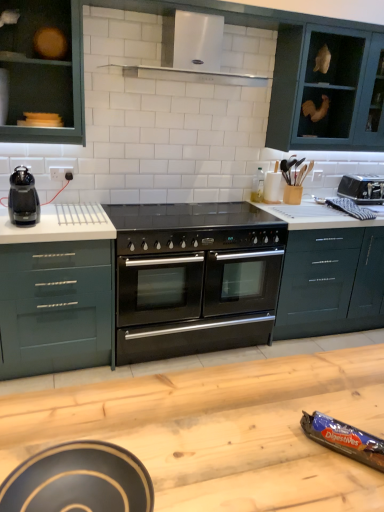
Question: Does white stainless steel exhaust hood at upper center lie in front of black matte oven at center?

Choices:
 (A) yes
 (B) no

Answer: (A)

Question: Does white stainless steel exhaust hood at upper center turn towards black matte oven at center?

Choices:
 (A) no
 (B) yes

Answer: (A)

Question: Is white stainless steel exhaust hood at upper center touching black matte oven at center?

Choices:
 (A) yes
 (B) no

Answer: (B)

Question: Is black matte oven at center at the back of white stainless steel exhaust hood at upper center?

Choices:
 (A) no
 (B) yes

Answer: (A)

Question: Can we say white stainless steel exhaust hood at upper center lies outside black matte oven at center?

Choices:
 (A) yes
 (B) no

Answer: (A)

Question: Does white stainless steel exhaust hood at upper center have a greater width compared to black matte oven at center?

Choices:
 (A) no
 (B) yes

Answer: (A)

Question: From a real-world perspective, does glossy dark green drawer at center-right, the first drawer in the right-to-left sequence, stand above matte black bowl at lower left, arranged as the 1th appliance when viewed from the front?

Choices:
 (A) no
 (B) yes

Answer: (A)

Question: Is the depth of glossy dark green drawer at center-right, the first drawer in the right-to-left sequence, greater than that of matte black bowl at lower left, positioned as the 3th appliance in top-to-bottom order?

Choices:
 (A) yes
 (B) no

Answer: (A)

Question: Can you confirm if glossy dark green drawer at center-right, the second drawer in the left-to-right sequence, is positioned to the right of matte black bowl at lower left, arranged as the 3th appliance when viewed from the right?

Choices:
 (A) no
 (B) yes

Answer: (B)

Question: Is glossy dark green drawer at center-right, the first drawer in the right-to-left sequence, facing towards matte black bowl at lower left, positioned as the 3th appliance in top-to-bottom order?

Choices:
 (A) no
 (B) yes

Answer: (A)

Question: Considering the relative sizes of glossy dark green drawer at center-right, the first drawer in the right-to-left sequence, and matte black bowl at lower left, arranged as the 3th appliance when viewed from the right, in the image provided, is glossy dark green drawer at center-right, the first drawer in the right-to-left sequence, bigger than matte black bowl at lower left, arranged as the 3th appliance when viewed from the right,?

Choices:
 (A) no
 (B) yes

Answer: (B)

Question: From the image's perspective, is glossy dark green drawer at center-right, the first drawer in the right-to-left sequence, beneath matte black bowl at lower left, placed as the first appliance when sorted from left to right?

Choices:
 (A) yes
 (B) no

Answer: (B)

Question: Is glossy dark green drawer at center-right, the second drawer in the left-to-right sequence, bigger than black plastic coffee maker at left?

Choices:
 (A) no
 (B) yes

Answer: (B)